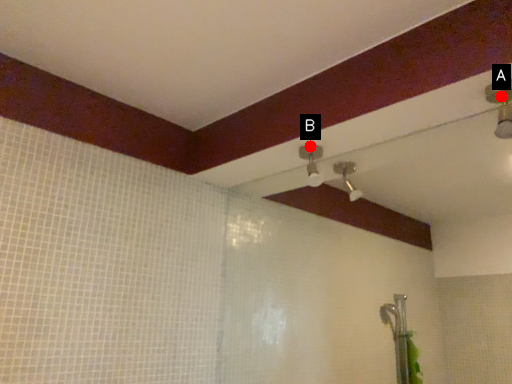
Question: Two points are circled on the image, labeled by A and B beside each circle. Which point is farther to the camera?

Choices:
 (A) A is further
 (B) B is further

Answer: (B)